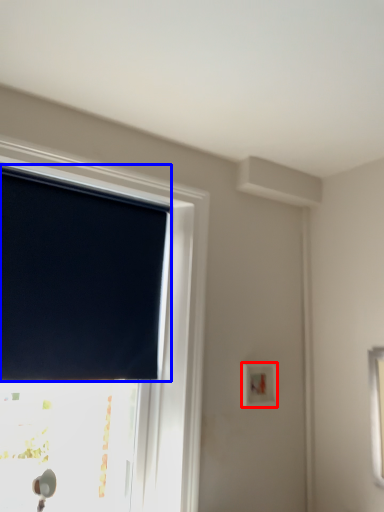
Question: Which of the following is the closest to the observer, light switch (highlighted by a red box) or window blind (highlighted by a blue box)?

Choices:
 (A) light switch
 (B) window blind

Answer: (B)